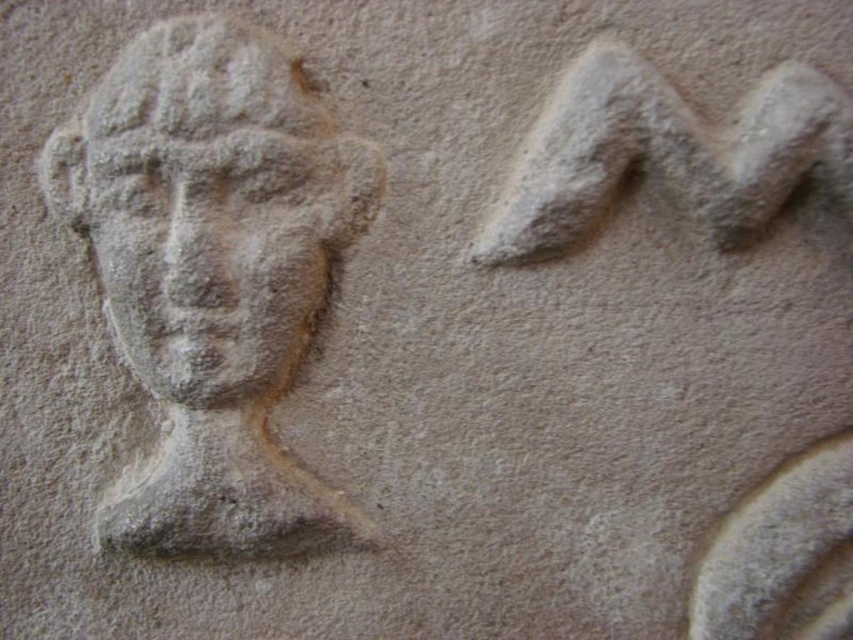
Question: Where is gray stone head at left located in relation to gray stone face at center in the image?

Choices:
 (A) above
 (B) below

Answer: (A)

Question: Among these points, which one is nearest to the camera?

Choices:
 (A) (260, 220)
 (B) (200, 44)

Answer: (B)

Question: Is gray stone head at left above gray stone face at center?

Choices:
 (A) yes
 (B) no

Answer: (A)

Question: Which point is farther to the camera?

Choices:
 (A) gray stone face at center
 (B) gray stone head at left

Answer: (A)

Question: Is gray stone head at left bigger than gray stone face at center?

Choices:
 (A) no
 (B) yes

Answer: (B)